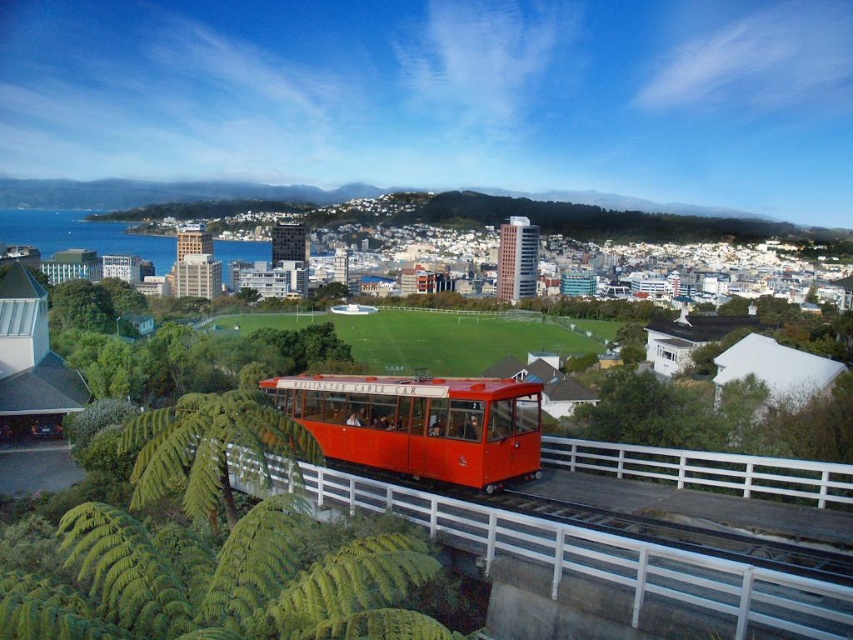
Question: Does metallic red cable car at center have a smaller size compared to white metal rail at center?

Choices:
 (A) yes
 (B) no

Answer: (B)

Question: Does metallic red cable car at center come in front of shiny red cable car at center?

Choices:
 (A) no
 (B) yes

Answer: (B)

Question: Which object is closer to the camera taking this photo?

Choices:
 (A) metallic red cable car at center
 (B) white metal rail at center
 (C) shiny red cable car at center

Answer: (A)

Question: Can you confirm if metallic red cable car at center is positioned to the right of white metal rail at center?

Choices:
 (A) yes
 (B) no

Answer: (B)

Question: Considering the real-world distances, which object is farthest from the white metal rail at center?

Choices:
 (A) metallic red cable car at center
 (B) shiny red cable car at center

Answer: (B)

Question: Which object is positioned closest to the white metal rail at center?

Choices:
 (A) metallic red cable car at center
 (B) shiny red cable car at center

Answer: (A)